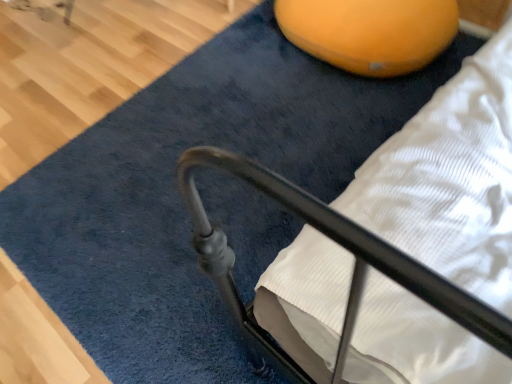
At what (x,y) coordinates should I click in order to perform the action: click on vacant space situated on the left part of matte orange cushion at upper right. Please return your answer as a coordinate pair (x, y). Looking at the image, I should click on (238, 78).